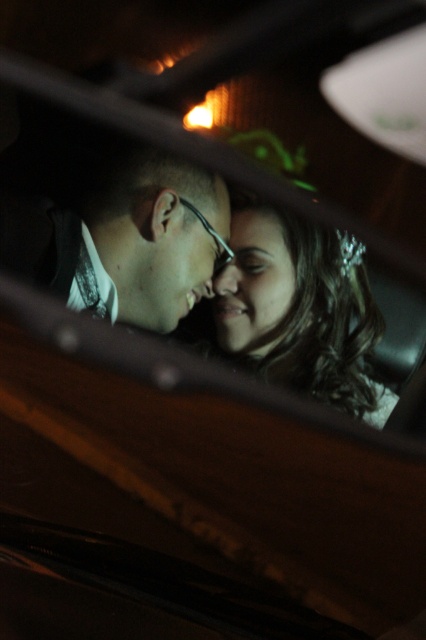
You are a photographer aiming to capture a closeup shot of both the matte black hair at center and the smooth skin face at center in this scene. Given their sizes, which one would require you to move closer to get a detailed shot?

The smooth skin face at center requires moving closer because it is smaller than the matte black hair at center, so to capture details, you need to be nearer to it.

The scene shows two people sitting in a car at night. You need to determine if the matte black hair at center is covering the matte black forehead at center based on their positions. Can you confirm?

The matte black hair at center is positioned under the matte black forehead at center, so it is not covering the forehead.

You are standing at the point marked by coordinates point (115, 296) and want to take a photo of the scene. Considering your height is 5 feet 6 inches, will the dashboard and steering wheel in the foreground block your view of the two people sitting in the back?

The point (115, 296) is 3.96 feet away from the viewer. Since the dashboard and steering wheel are in the foreground, they might block the view depending on the angle, but the distance suggests you can step back slightly to ensure both the dashboard and steering wheel are in the frame while still capturing the two people in the back.